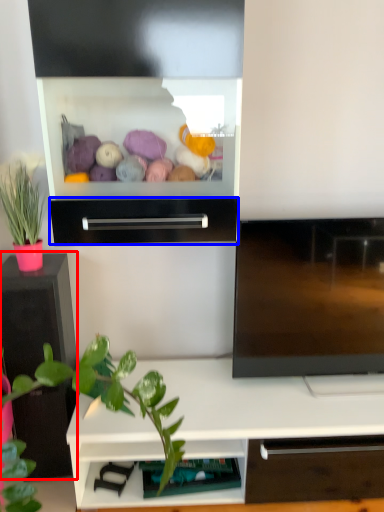
Question: Among these objects, which one is farthest to the camera, tv cabinet (highlighted by a red box) or drawer (highlighted by a blue box)?

Choices:
 (A) tv cabinet
 (B) drawer

Answer: (A)